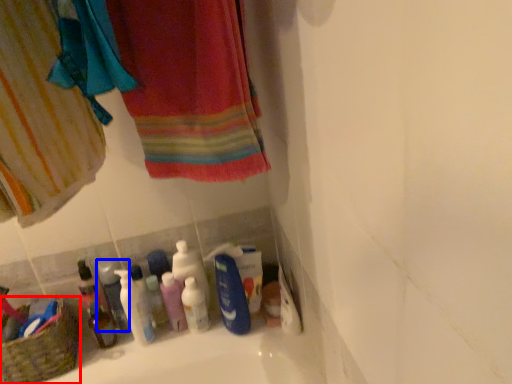
Question: Which object is further to the camera taking this photo, basket (highlighted by a red box) or mouthwash (highlighted by a blue box)?

Choices:
 (A) basket
 (B) mouthwash

Answer: (B)